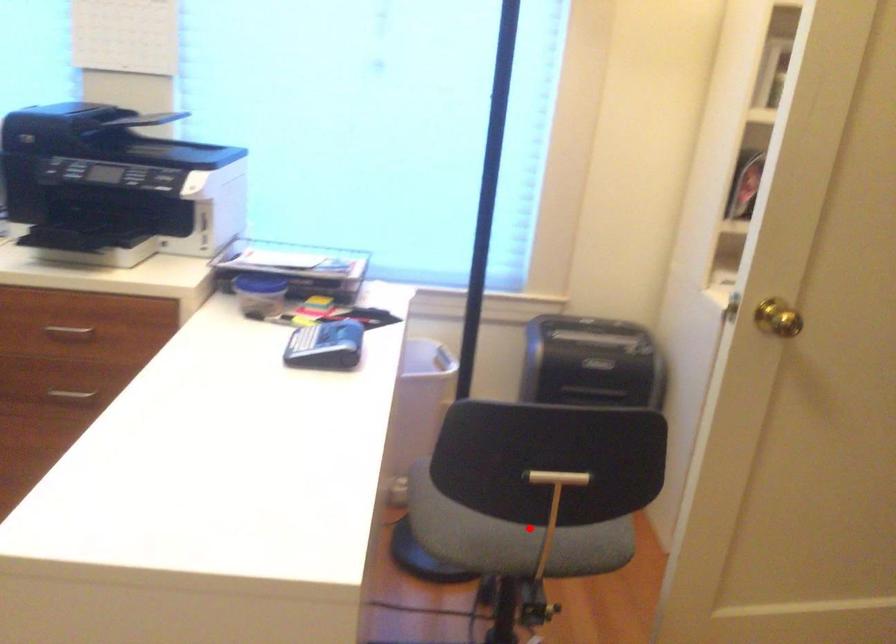
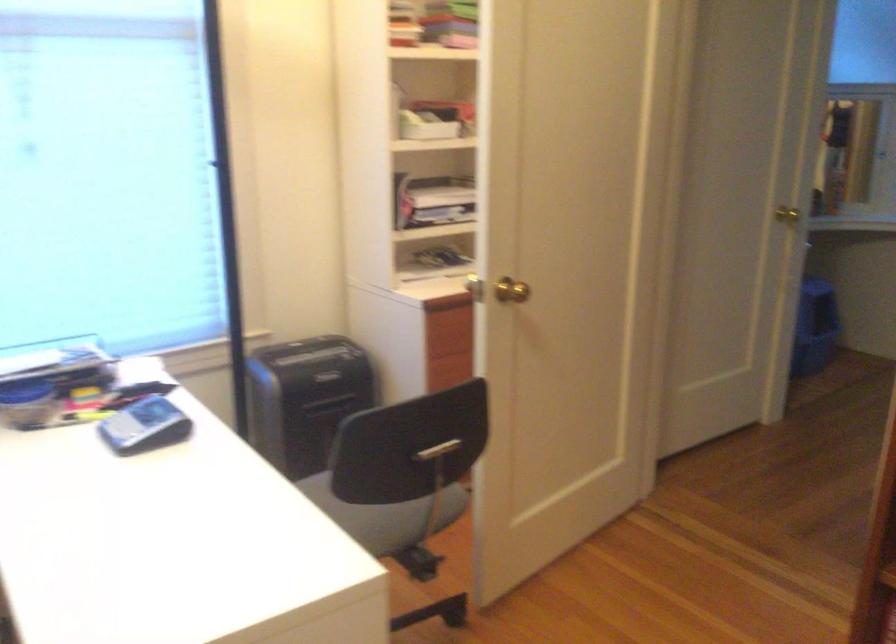
Question: I am providing you with two images of the same scene from different viewpoints. A red point is shown in image1. For the corresponding object point in image2, is it positioned nearer or farther from the camera?

Choices:
 (A) Nearer
 (B) Farther

Answer: (B)